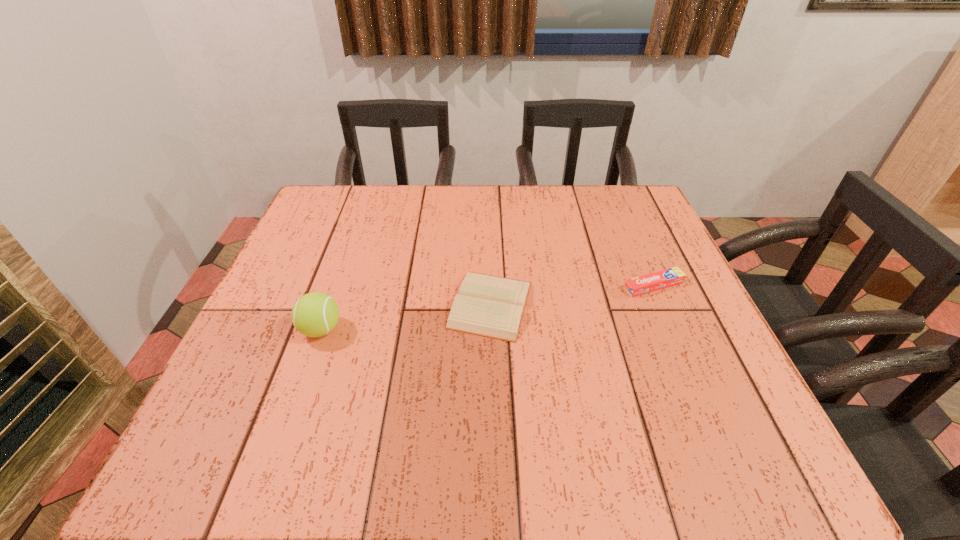
At what (x,y) coordinates should I click in order to perform the action: click on tennis ball. Please return your answer as a coordinate pair (x, y). Looking at the image, I should click on (315, 314).

This screenshot has height=540, width=960. Identify the location of the leftmost object. (315, 314).

At what (x,y) coordinates should I click in order to perform the action: click on diary. Please return your answer as a coordinate pair (x, y). This screenshot has width=960, height=540. Looking at the image, I should click on (490, 306).

Identify the location of toothpaste. (666, 278).

This screenshot has width=960, height=540. I want to click on vacant space located on the front of the tallest object, so click(x=284, y=434).

Where is `free space located on the right of the second object from left to right`? The image size is (960, 540). free space located on the right of the second object from left to right is located at coordinates (700, 305).

This screenshot has height=540, width=960. I want to click on vacant point located on the back of the toothpaste, so click(623, 215).

Locate an element on the screen. The image size is (960, 540). object located in the left edge section of the desktop is located at coordinates (315, 314).

I want to click on object located at the right edge, so click(x=666, y=278).

In the image, there is a desktop. Identify the location of vacant space at the far edge. (554, 212).